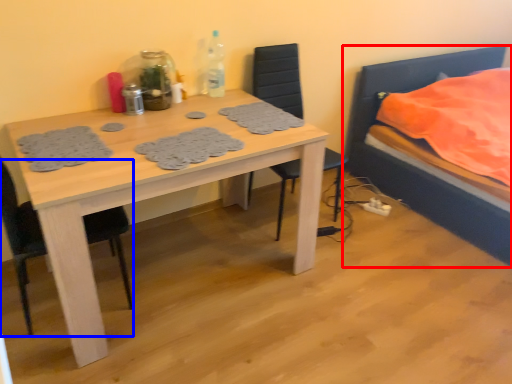
Question: Among these objects, which one is farthest to the camera, bed (highlighted by a red box) or chair (highlighted by a blue box)?

Choices:
 (A) bed
 (B) chair

Answer: (A)